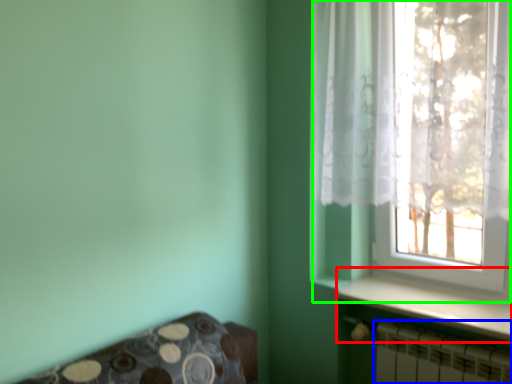
Question: Which object is positioned closest to window sill (highlighted by a red box)? Select from radiator (highlighted by a blue box) and window (highlighted by a green box).

Choices:
 (A) radiator
 (B) window

Answer: (A)